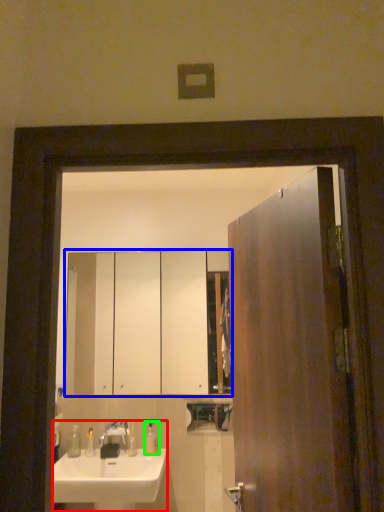
Question: Which is farther away from sink (highlighted by a red box)? cabinetry (highlighted by a blue box) or soap dispenser (highlighted by a green box)?

Choices:
 (A) cabinetry
 (B) soap dispenser

Answer: (A)